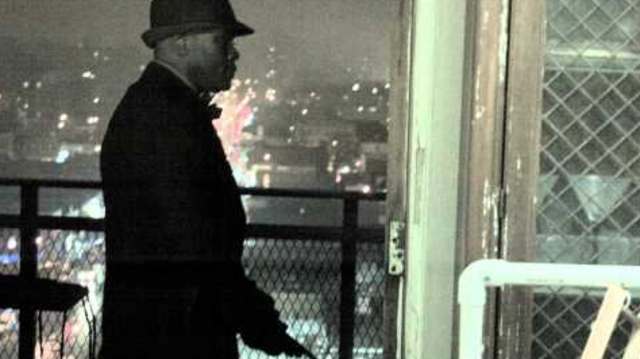
This screenshot has height=359, width=640. Identify the location of door hinge. (397, 255).